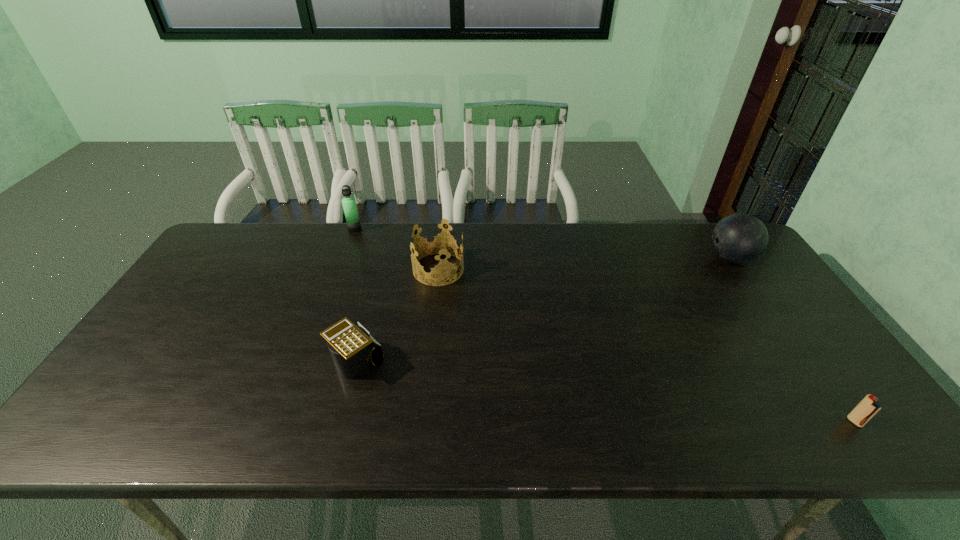
Identify the location of the farthest object. The image size is (960, 540). (353, 223).

Image resolution: width=960 pixels, height=540 pixels. I want to click on the leftmost object, so click(353, 223).

Where is `bowling ball`? The width and height of the screenshot is (960, 540). bowling ball is located at coordinates tap(739, 238).

This screenshot has width=960, height=540. What are the coordinates of `crown` in the screenshot? It's located at (436, 245).

Where is `the fourth object from right to left`? The width and height of the screenshot is (960, 540). the fourth object from right to left is located at coordinates (353, 350).

At what (x,y) coordinates should I click in order to perform the action: click on calculator. Please return your answer as a coordinate pair (x, y). Image resolution: width=960 pixels, height=540 pixels. Looking at the image, I should click on tap(353, 350).

Find the location of a particular element. The image size is (960, 540). igniter is located at coordinates (868, 407).

Locate an element on the screen. This screenshot has height=540, width=960. the nearest object is located at coordinates (868, 407).

Where is `free location located on the front of the leftmost object`? free location located on the front of the leftmost object is located at coordinates (349, 242).

Locate an element on the screen. The image size is (960, 540). free region located on the grip area of the bowling ball is located at coordinates (647, 258).